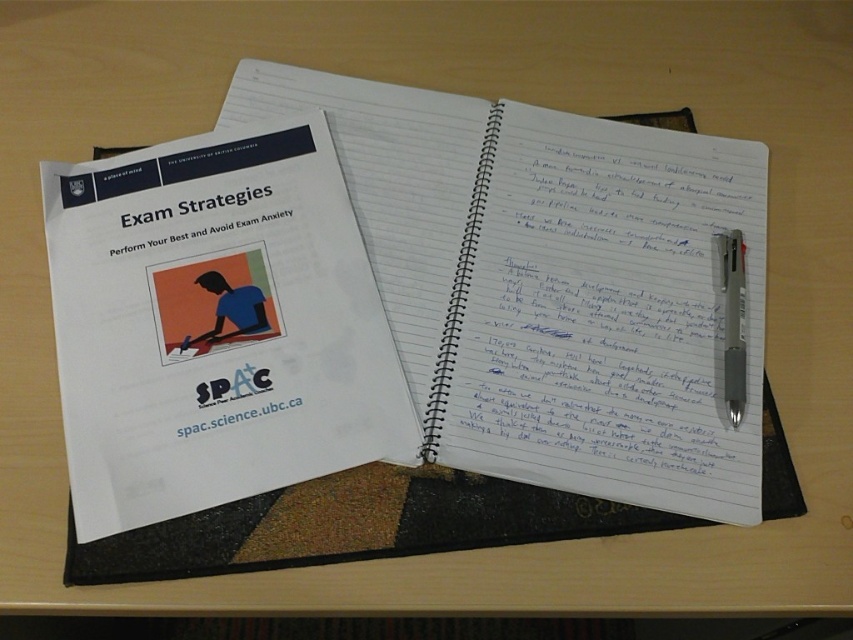
Does white lined paper at center have a lesser width compared to silver metallic pen at upper right?

No.

Is white lined paper at center shorter than silver metallic pen at upper right?

In fact, white lined paper at center may be taller than silver metallic pen at upper right.

From the picture: Measure the distance between white lined paper at center and camera.

19.88 inches

Image resolution: width=853 pixels, height=640 pixels. I want to click on white lined paper at center, so click(x=514, y=305).